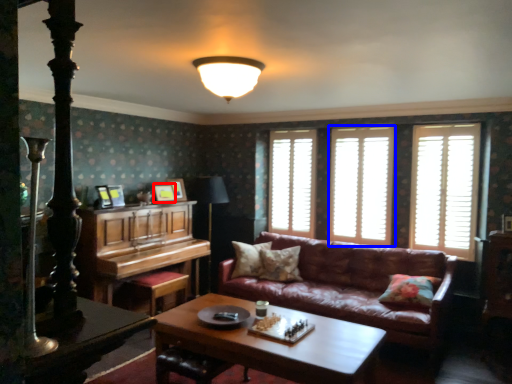
Question: Which object appears farthest to the camera in this image, picture frame (highlighted by a red box) or window (highlighted by a blue box)?

Choices:
 (A) picture frame
 (B) window

Answer: (A)